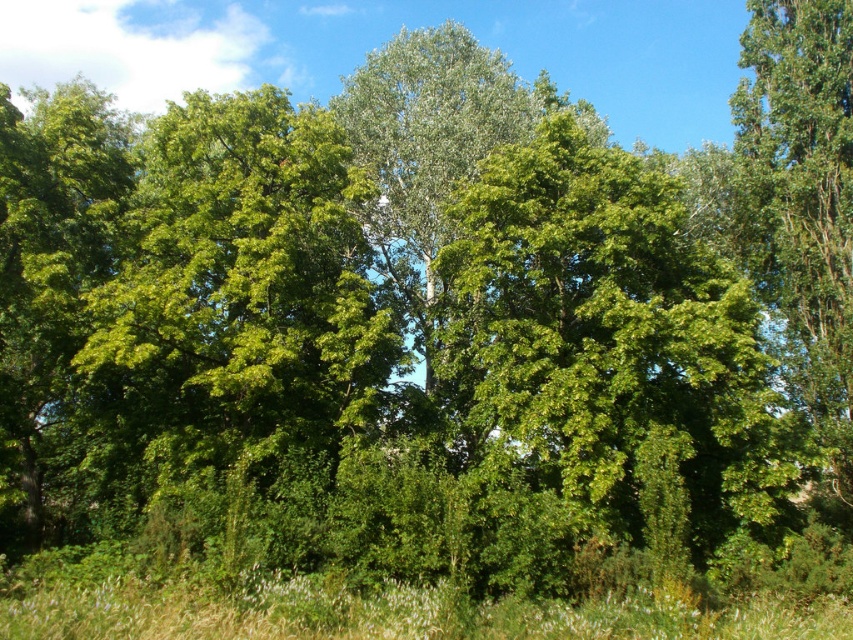
Is point (689, 316) closer to camera compared to point (428, 588)?

That is False.

Who is more forward, (x=682, y=467) or (x=560, y=627)?

Point (x=560, y=627) is in front.

The height and width of the screenshot is (640, 853). What do you see at coordinates (602, 356) in the screenshot?
I see `green leafy tree at center` at bounding box center [602, 356].

Identify the location of green leafy tree at center. (x=602, y=356).

Does point (572, 420) come in front of point (785, 294)?

Yes, point (572, 420) is closer to viewer.

At what (x,y) coordinates should I click in order to perform the action: click on green leafy tree at center. Please return your answer as a coordinate pair (x, y). Looking at the image, I should click on (602, 356).

Locate an element on the screen. Image resolution: width=853 pixels, height=640 pixels. green leafy tree at center is located at coordinates (602, 356).

How much distance is there between green grassy at lower center and green leafy tree at right?

A distance of 11.08 meters exists between green grassy at lower center and green leafy tree at right.

Locate an element on the screen. green grassy at lower center is located at coordinates (364, 608).